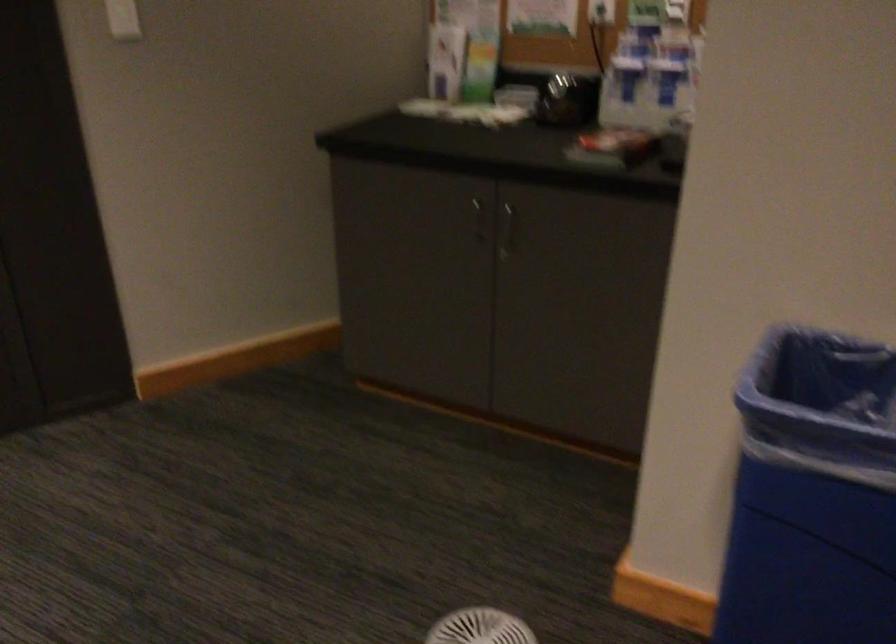
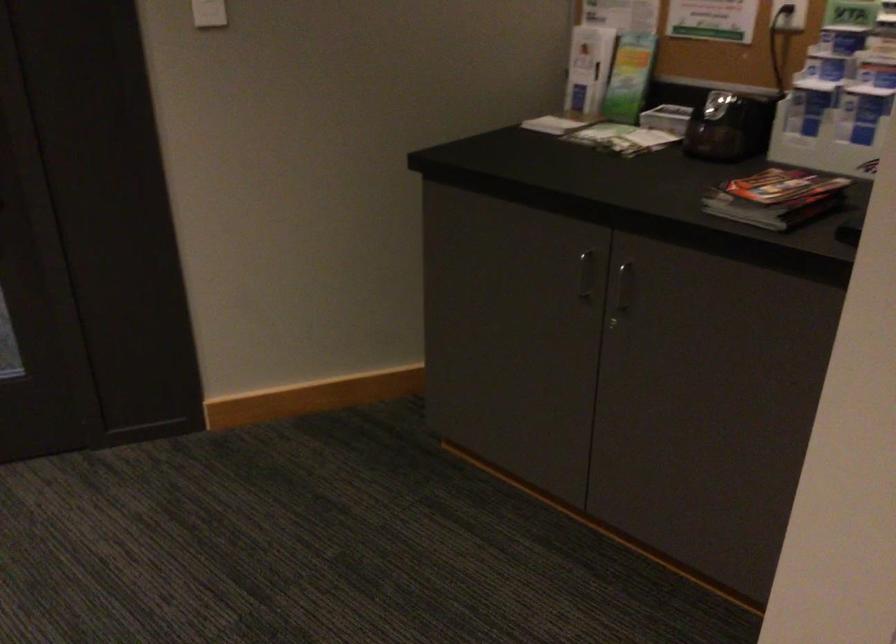
Where in the second image is the point corresponding to point (428, 102) from the first image?

(556, 122)